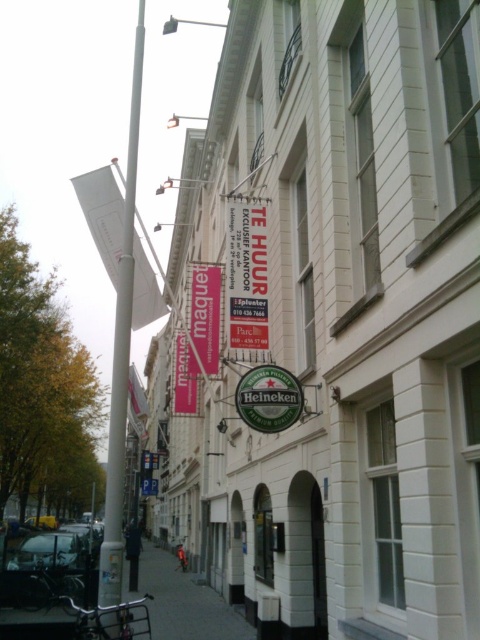
You are a delivery person standing on the sidewalk looking down the street. You need to place a new white plastic pole at left. Where should you place it?

The white plastic pole at left should be placed at the 2D location point (121, 353).

You are standing on the sidewalk looking down the street. There is a white matte signboard at upper center marked by point (339, 321). Is the signboard located above or below the buildings on the right side?

The white matte signboard at upper center marked by point (339, 321) is located above the buildings on the right side since it is at the upper part of the image.

You are a delivery person trying to navigate through the gray concrete sidewalk at lower center. There is a white matte signboard at upper center above you. Could the signboard possibly block your path while moving forward?

The white matte signboard at upper center might be wider than the gray concrete sidewalk at lower center, so there is a possibility that the signboard could block your path while moving forward.